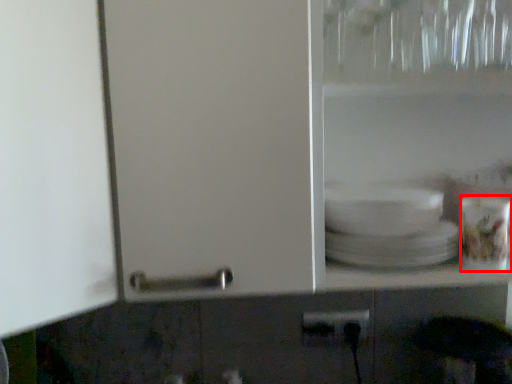
Question: From the image's perspective, considering the relative positions of tableware (annotated by the red box) and power plugs and sockets in the image provided, where is tableware (annotated by the red box) located with respect to the staircase?

Choices:
 (A) below
 (B) above

Answer: (B)